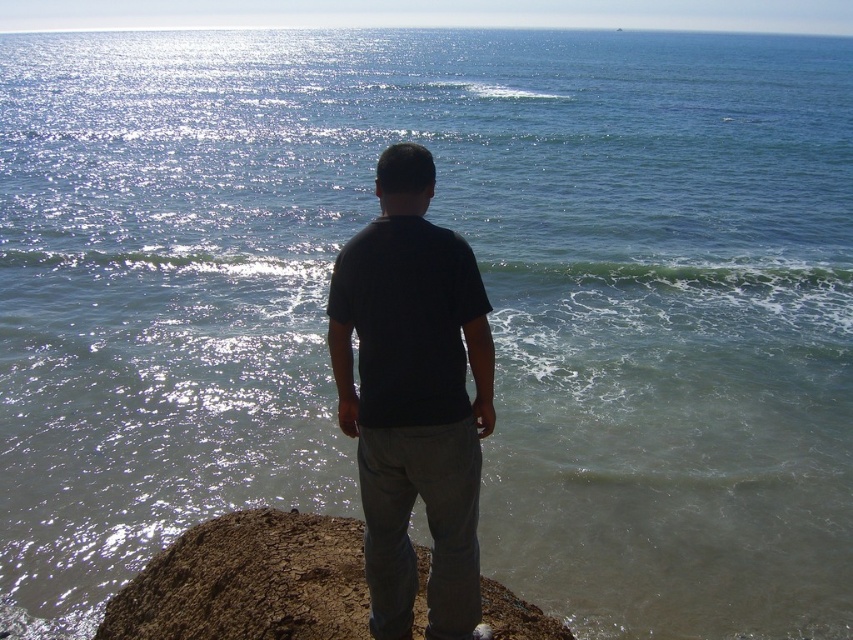
You are a photographer trying to capture the contrast between the dark matte shirt at center and the dull brown dirt at center in the coastal scene. Since you want the shirt to appear more prominent in the photo, which object should you focus on to ensure the shirt stands out against the dirt?

The dark matte shirt at center has a lesser width compared to the dull brown dirt at center. To make the shirt stand out, focus on the dark matte shirt at center so its smaller size contrasts effectively with the wider dull brown dirt at center.

You are a photographer trying to capture the scene of the dark matte shirt at center and the dull brown dirt at center. Based on their positions, which object should you focus on first if you want to include both in a single frame without moving the camera?

The dark matte shirt at center is positioned on the right side of dull brown dirt at center, so you should focus on the dull brown dirt at center first since it is closer to the left side, allowing both objects to be captured in the frame without moving the camera.